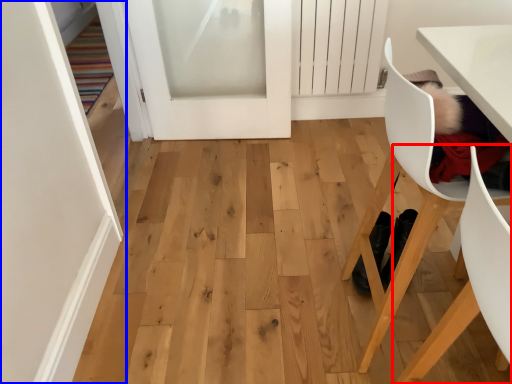
Question: Which object appears closest to the camera in this image, chair (highlighted by a red box) or door (highlighted by a blue box)?

Choices:
 (A) chair
 (B) door

Answer: (A)